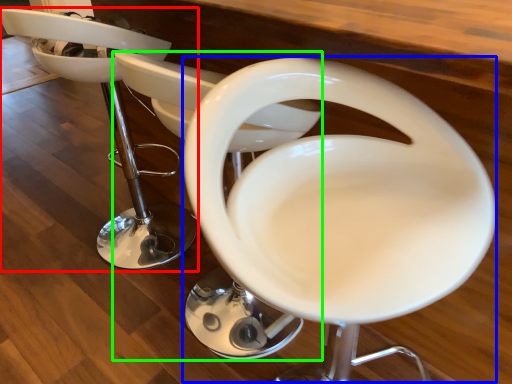
Question: Considering the real-world distances, which object is closest to chair (highlighted by a red box)? feeding chair (highlighted by a blue box) or feeding chair (highlighted by a green box).

Choices:
 (A) feeding chair
 (B) feeding chair

Answer: (B)